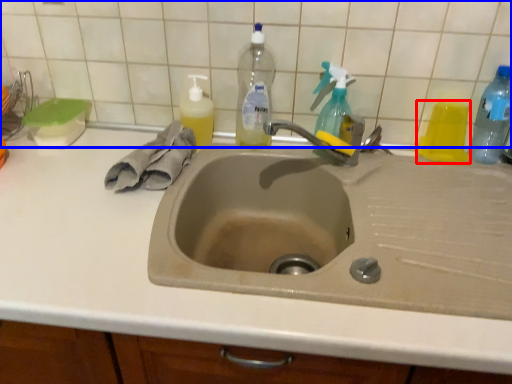
Question: Which of the following is the closest to the observer, bottle (highlighted by a red box) or tile (highlighted by a blue box)?

Choices:
 (A) bottle
 (B) tile

Answer: (B)